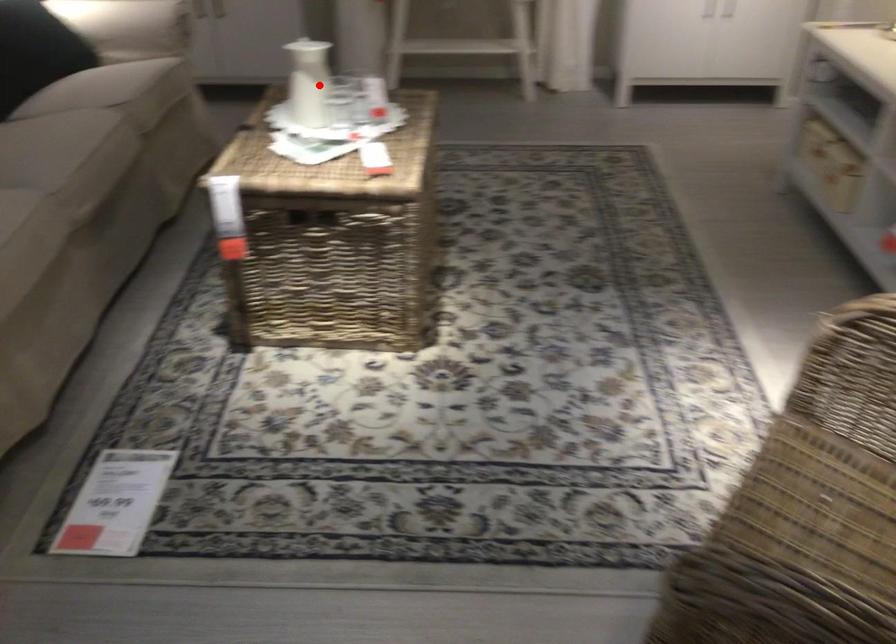
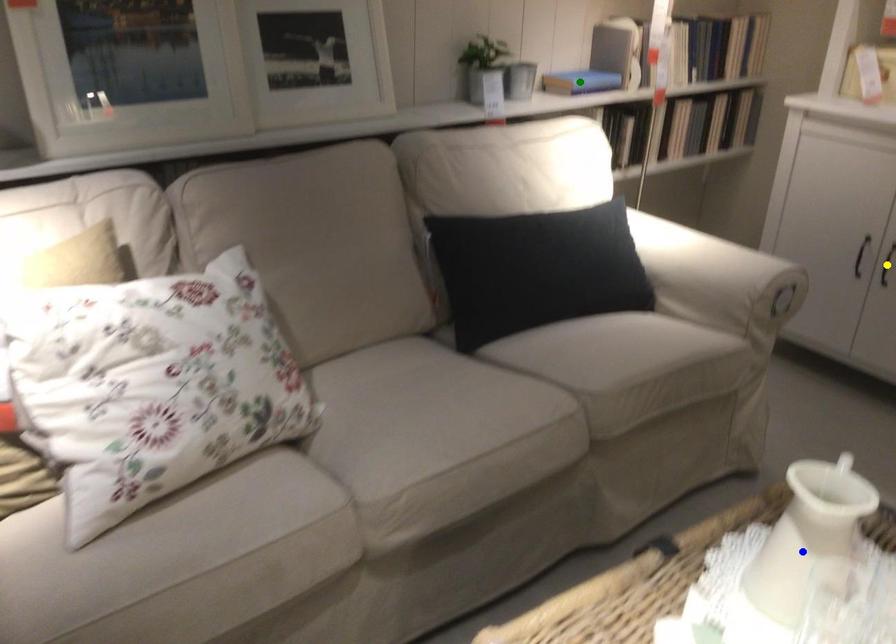
Question: I am providing you with two images of the same scene from different viewpoints. A red point is marked on the first image. You are given multiple points on the second image. Which mark in image 2 goes with the point in image 1?

Choices:
 (A) green point
 (B) blue point
 (C) yellow point

Answer: (B)